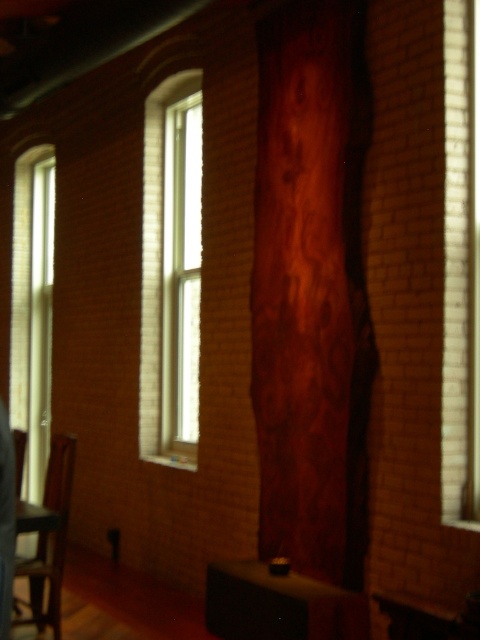
You are standing in the room and want to move from point A to point B. The coordinates for point A are point (48, 301) and point B are point (151, 442). According to the scene description, can you walk directly from point A to point B without any obstacles?

Point (48, 301) is behind point (151, 442), so you cannot walk directly from point A to point B without any obstacles.

You are an interior designer planning to install a new curtain. You have two options for the clear glass window at left and the white wood window at center. If you want the curtains to be proportional to the window sizes, which window should get the larger curtain?

The clear glass window at left should get the larger curtain because it has a larger size compared to the white wood window at center according to the description.

You are standing in the room and want to look outside through the clear glass window at left. However, there is a shiny black phone at left blocking your view. Can you see the outside through the window without moving the phone?

The clear glass window at left is bigger than the shiny black phone at left, so part of the window is still visible beyond the phone, allowing you to see outside without moving it.